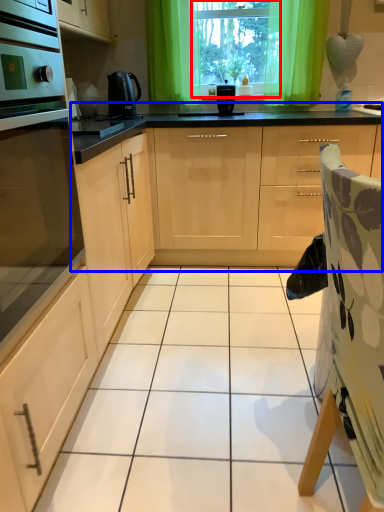
Question: Which object appears farthest to the camera in this image, window screen (highlighted by a red box) or cabinetry (highlighted by a blue box)?

Choices:
 (A) window screen
 (B) cabinetry

Answer: (A)